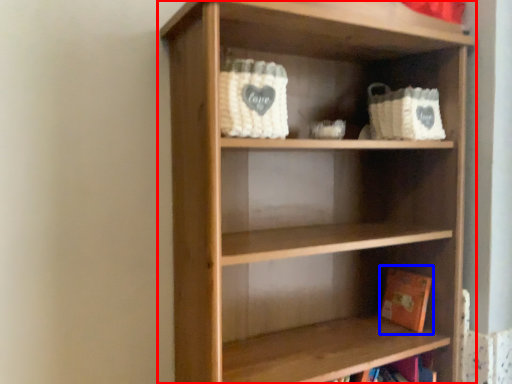
Question: Which object is further to the camera taking this photo, shelf (highlighted by a red box) or book (highlighted by a blue box)?

Choices:
 (A) shelf
 (B) book

Answer: (B)